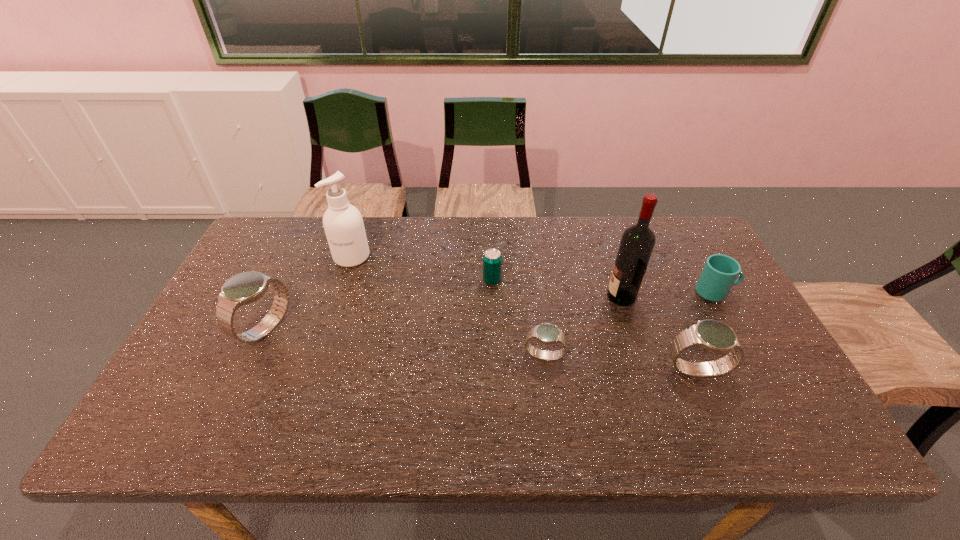
The height and width of the screenshot is (540, 960). Identify the location of spot to insert another watch for uniform distribution. (400, 342).